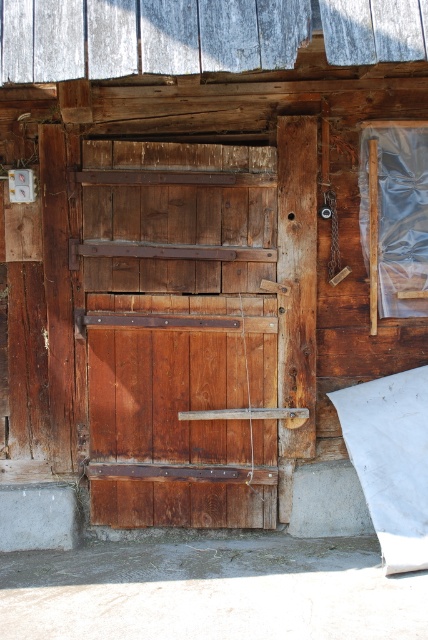
Question: Does rustic wood barn door at center have a smaller size compared to rustic wood door at center?

Choices:
 (A) no
 (B) yes

Answer: (A)

Question: Which of the following is the closest to the observer?

Choices:
 (A) tap(151, 192)
 (B) tap(127, 396)

Answer: (A)

Question: Is rustic wood barn door at center to the left of rustic wood door at center from the viewer's perspective?

Choices:
 (A) no
 (B) yes

Answer: (B)

Question: Can you confirm if rustic wood barn door at center is smaller than rustic wood door at center?

Choices:
 (A) no
 (B) yes

Answer: (A)